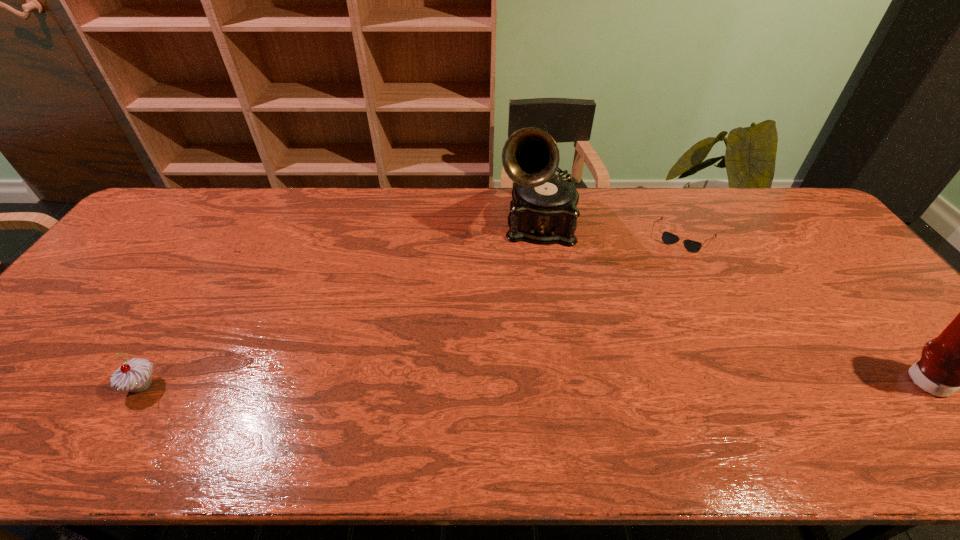
Find the location of a particular element. free location at the far right corner of the desktop is located at coordinates (776, 199).

The height and width of the screenshot is (540, 960). I want to click on blank region between the second object from left to right and the leftmost object, so click(341, 305).

Where is `free point between the leftmost object and the second object from right to left`? Image resolution: width=960 pixels, height=540 pixels. free point between the leftmost object and the second object from right to left is located at coordinates (414, 311).

Identify the location of free space between the phonograph record and the cupcake. (341, 305).

Find the location of a particular element. The width and height of the screenshot is (960, 540). vacant region between the phonograph record and the cupcake is located at coordinates (341, 305).

Where is `vacant area that lies between the sunglasses and the tallest object`? The height and width of the screenshot is (540, 960). vacant area that lies between the sunglasses and the tallest object is located at coordinates (612, 231).

The height and width of the screenshot is (540, 960). I want to click on vacant space that's between the leftmost object and the tallest object, so click(x=341, y=305).

This screenshot has width=960, height=540. Identify the location of free space between the tallest object and the cupcake. (341, 305).

This screenshot has height=540, width=960. What are the coordinates of `free spot between the third tallest object and the sunglasses` in the screenshot? It's located at (414, 311).

Image resolution: width=960 pixels, height=540 pixels. I want to click on free space between the cupcake and the shortest object, so click(x=414, y=311).